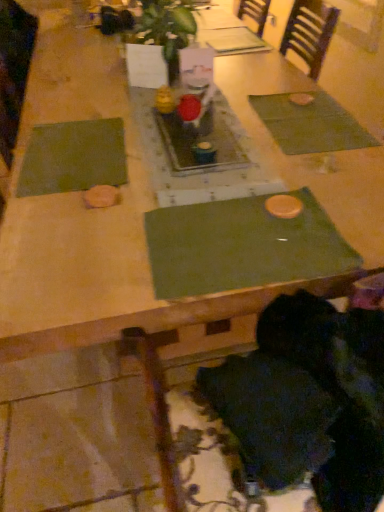
Where is `blank space situated above green fabric placemat at upper right, which is counted as the first place mat, starting from the right (from a real-world perspective)`? This screenshot has width=384, height=512. blank space situated above green fabric placemat at upper right, which is counted as the first place mat, starting from the right (from a real-world perspective) is located at coordinates (309, 117).